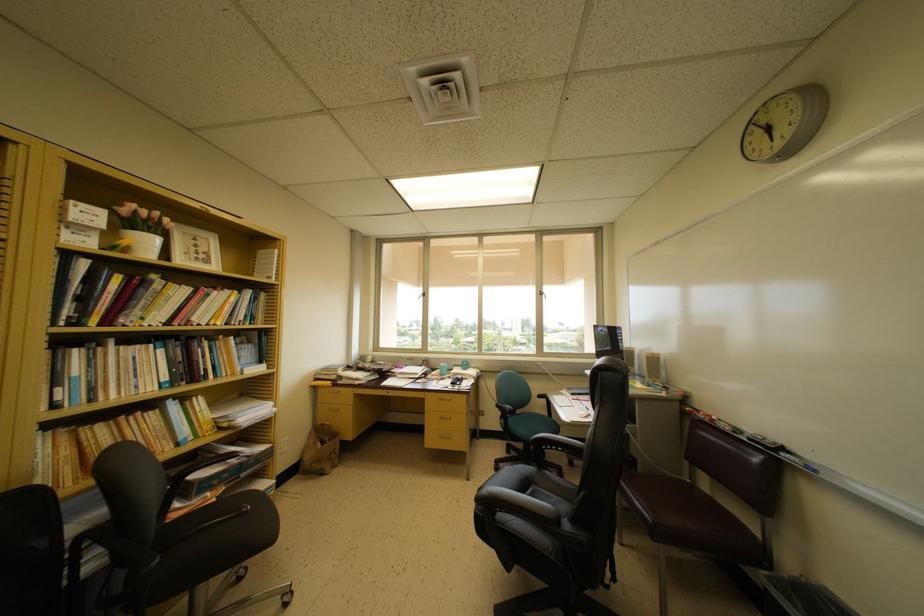
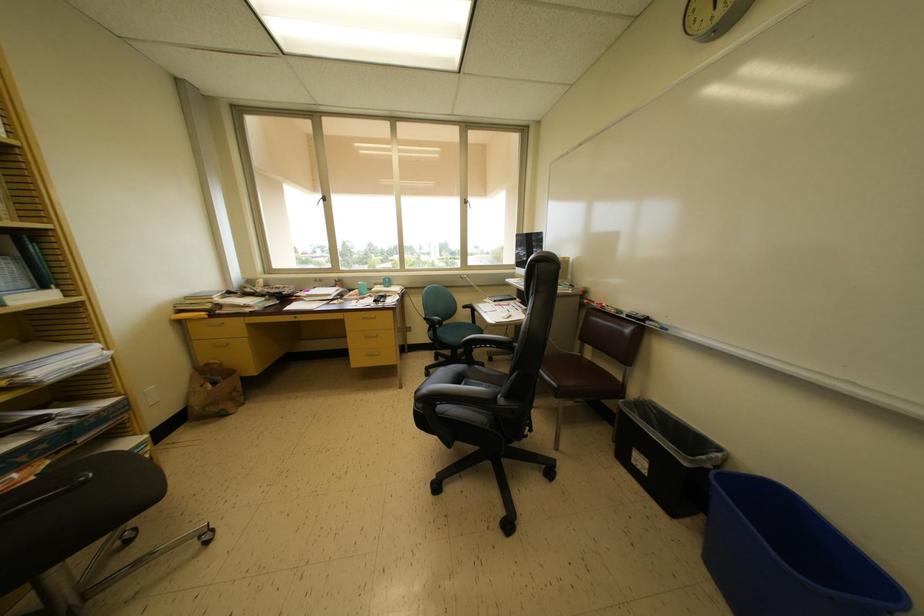
Question: The images are taken continuously from a first-person perspective. In which direction are you moving?

Choices:
 (A) Left
 (B) Right
 (C) Forward
 (D) Backward

Answer: (C)